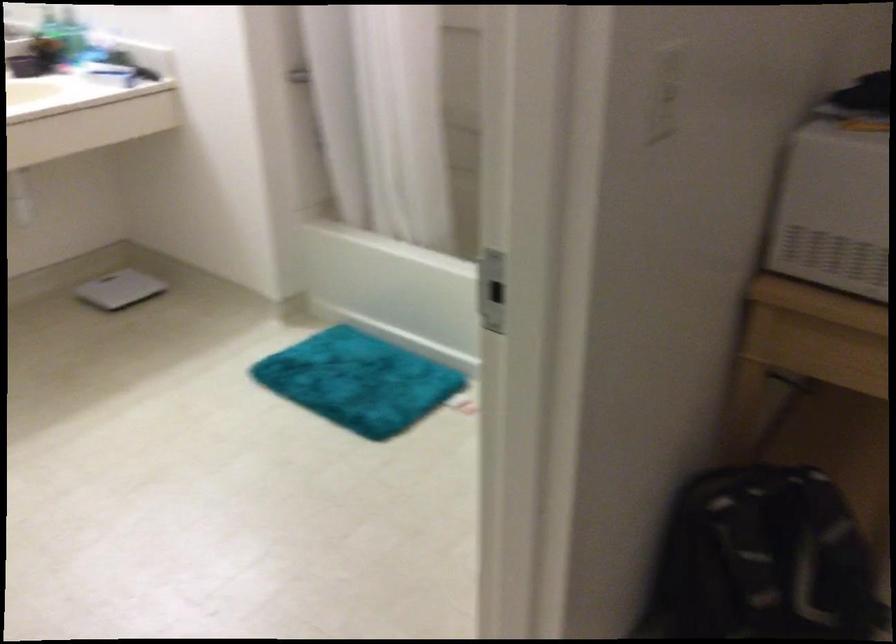
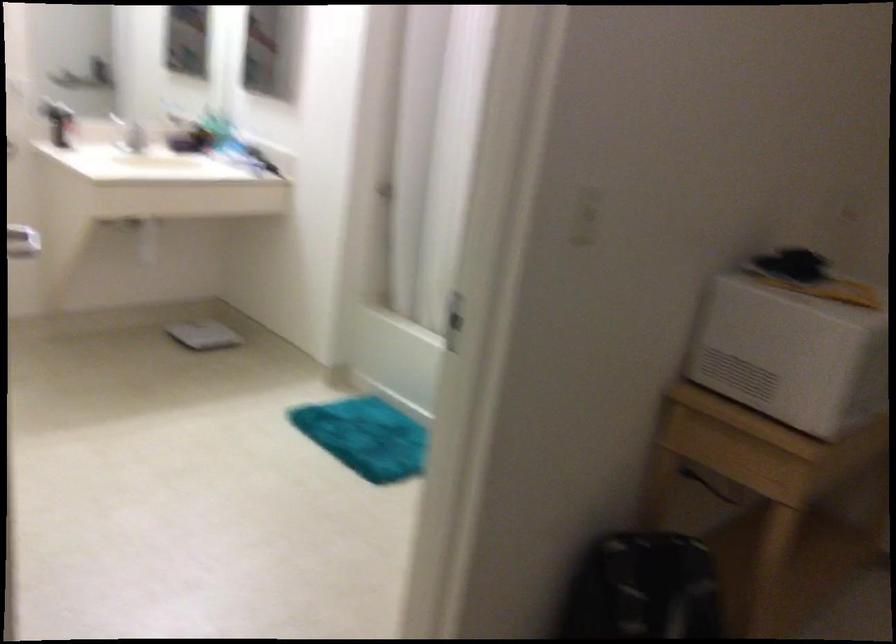
Question: The first image is from the beginning of the video and the second image is from the end. How did the camera likely rotate when shooting the video?

Choices:
 (A) Left
 (B) Right
 (C) Up
 (D) Down

Answer: (C)